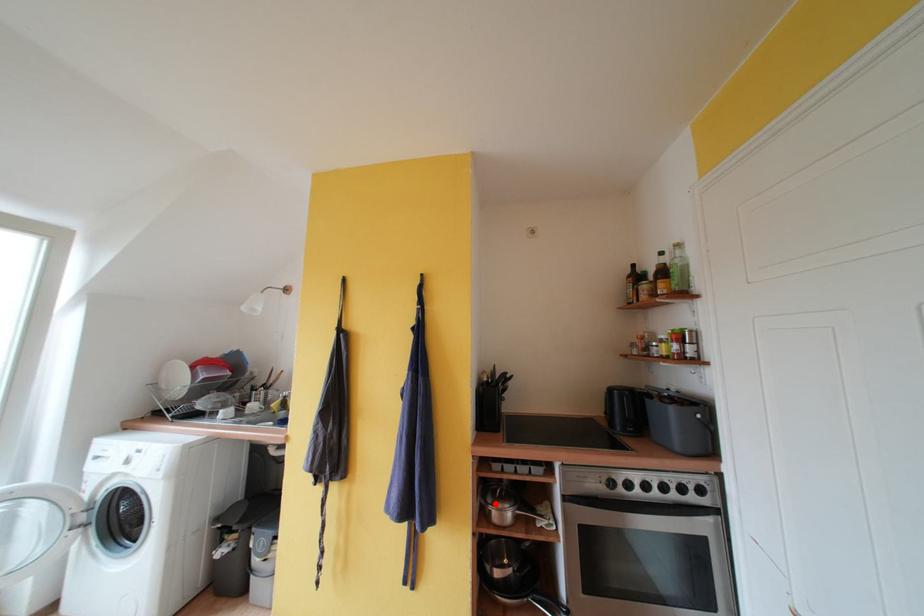
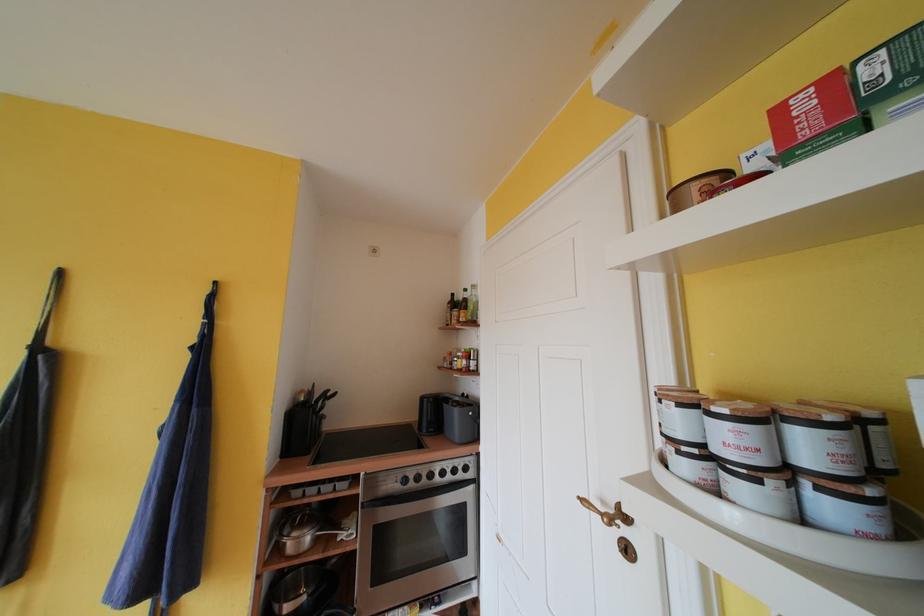
Locate, in the second image, the point that corresponds to the highlighted location in the first image.

(293, 535)